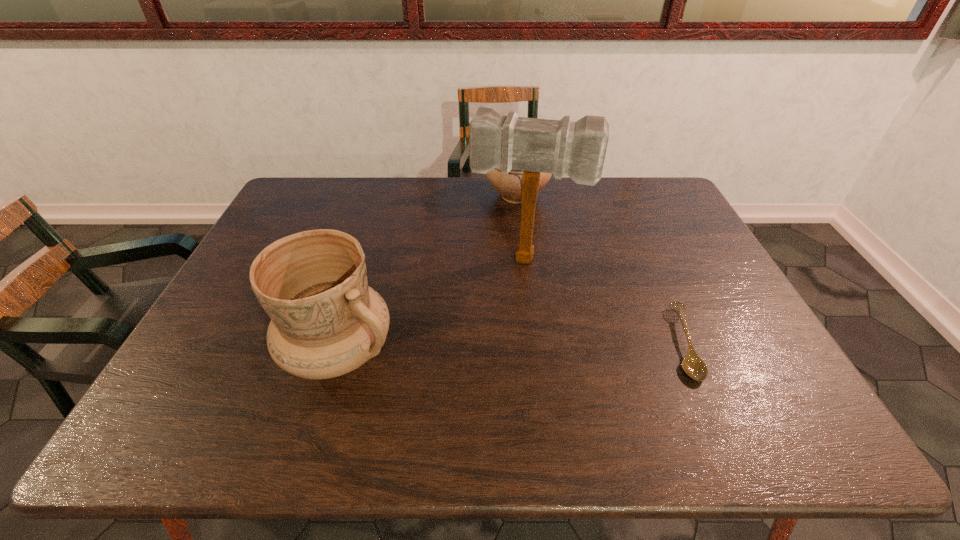
Locate an element on the screen. This screenshot has width=960, height=540. free space on the desktop that is between the leftmost object and the rightmost object and is positioned on the front-facing side of the farthest object is located at coordinates (x=536, y=347).

Where is `free space on the desktop that is between the leftmost object and the ladle and is positioned at the head of the tallest object`? The height and width of the screenshot is (540, 960). free space on the desktop that is between the leftmost object and the ladle and is positioned at the head of the tallest object is located at coordinates (508, 347).